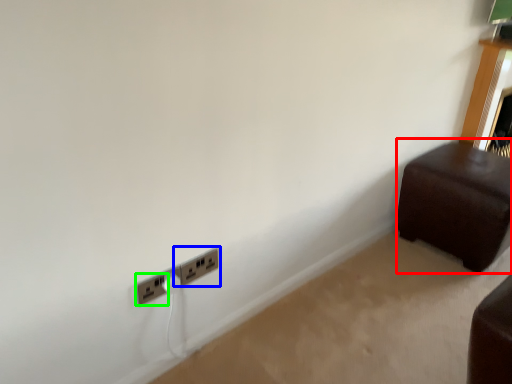
Question: Which is nearer to the furniture (highlighted by a red box)? power plugs and sockets (highlighted by a blue box) or power plugs and sockets (highlighted by a green box).

Choices:
 (A) power plugs and sockets
 (B) power plugs and sockets

Answer: (A)